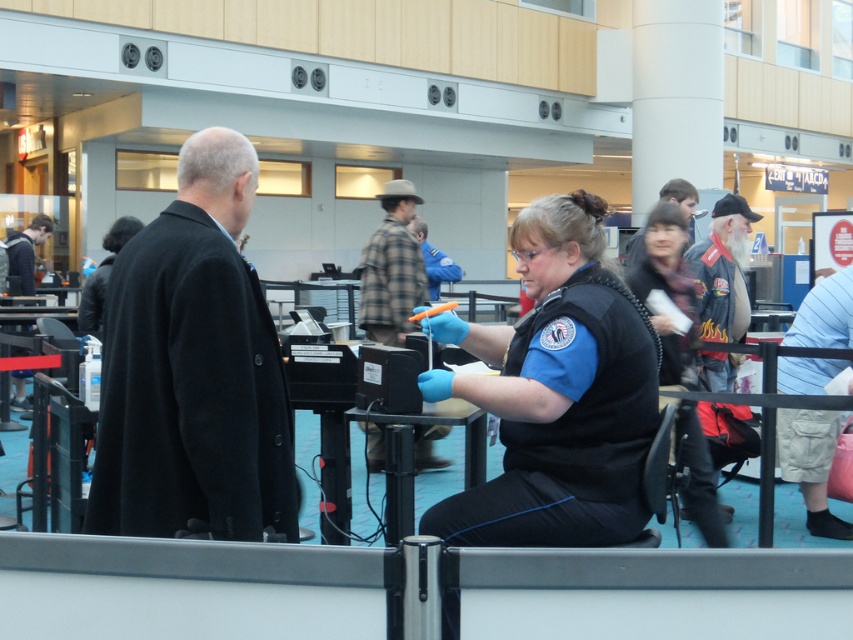
Can you confirm if plaid fabric shirt at center is positioned above dark brown leather jacket at upper center?

Actually, plaid fabric shirt at center is below dark brown leather jacket at upper center.

Can you confirm if plaid fabric shirt at center is positioned to the left of dark brown leather jacket at upper center?

Yes, plaid fabric shirt at center is to the left of dark brown leather jacket at upper center.

Which is behind, point (380, 461) or point (677, 188)?

The point (380, 461) is behind.

Locate an element on the screen. plaid fabric shirt at center is located at coordinates (392, 268).

Between leather jacket at right and dark blue jacket at left, which one has more height?

leather jacket at right

Is leather jacket at right wider than dark blue jacket at left?

Indeed, leather jacket at right has a greater width compared to dark blue jacket at left.

The width and height of the screenshot is (853, 640). What are the coordinates of `leather jacket at right` in the screenshot? It's located at (723, 269).

Which is above, tan cotton shorts at right or dark blue jacket at left?

Positioned higher is dark blue jacket at left.

Locate an element on the screen. This screenshot has height=640, width=853. tan cotton shorts at right is located at coordinates (810, 464).

Does point (787, 360) come closer to viewer compared to point (10, 248)?

That is True.

Locate an element on the screen. tan cotton shorts at right is located at coordinates click(x=810, y=464).